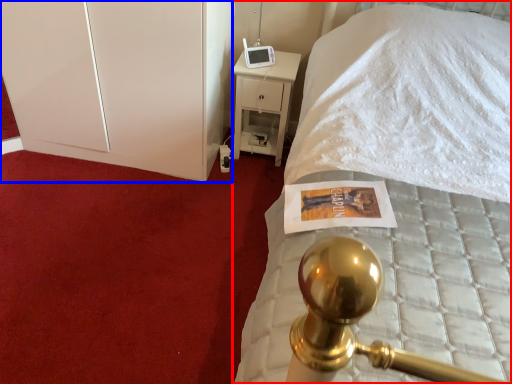
Question: Which of the following is the closest to the observer, bed (highlighted by a red box) or dresser (highlighted by a blue box)?

Choices:
 (A) bed
 (B) dresser

Answer: (A)